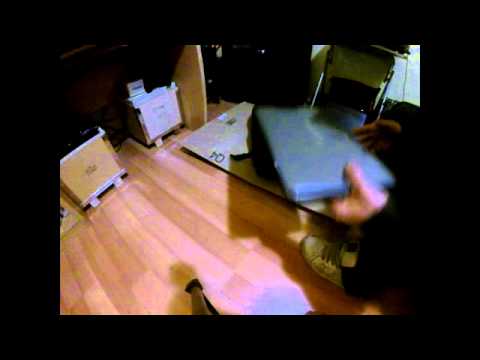
I want to click on brown divider, so click(190, 79).